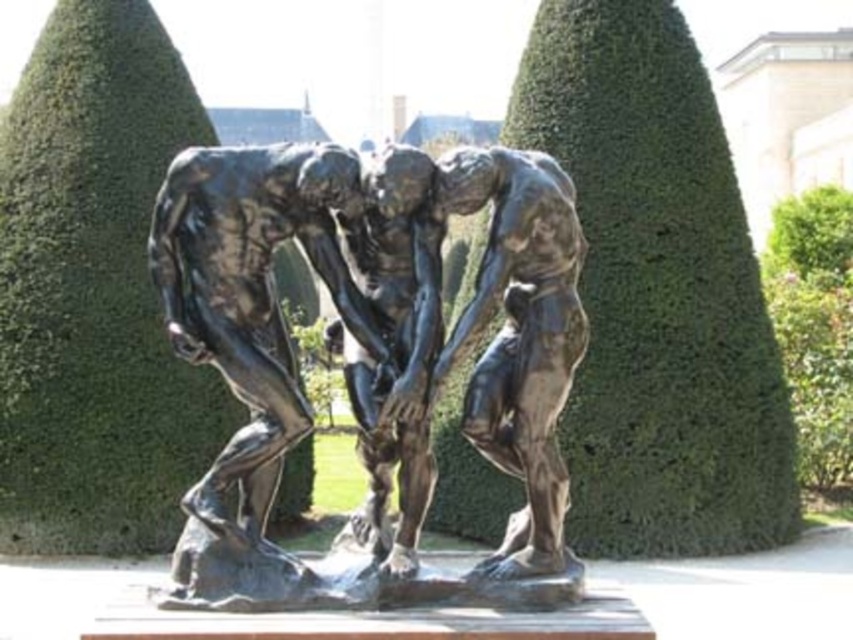
Does green leafy bush at right appear on the right side of green leafy bush at upper right?

No, green leafy bush at right is not to the right of green leafy bush at upper right.

Is green leafy bush at right thinner than green leafy bush at upper right?

In fact, green leafy bush at right might be wider than green leafy bush at upper right.

The width and height of the screenshot is (853, 640). I want to click on green leafy bush at right, so click(814, 326).

Is point (532, 467) positioned behind point (605, 438)?

No.

Describe the element at coordinates (375, 358) in the screenshot. The image size is (853, 640). I see `bronze sculpture at center` at that location.

Who is more distant from viewer, (491,413) or (608,260)?

Point (608,260)

The image size is (853, 640). Identify the location of bronze sculpture at center. (375, 358).

Which is more to the left, green leafy hedge at center or green leafy bush at right?

Positioned to the left is green leafy hedge at center.

Which of these two, green leafy hedge at center or green leafy bush at right, stands shorter?

Standing shorter between the two is green leafy bush at right.

Describe the element at coordinates (657, 292) in the screenshot. This screenshot has height=640, width=853. I see `green leafy hedge at center` at that location.

Where is `green leafy hedge at center`? The width and height of the screenshot is (853, 640). green leafy hedge at center is located at coordinates (657, 292).